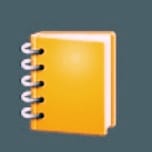
This screenshot has width=152, height=152. What are the coordinates of `yellow front cover of a small notebook` in the screenshot? It's located at (77, 79).